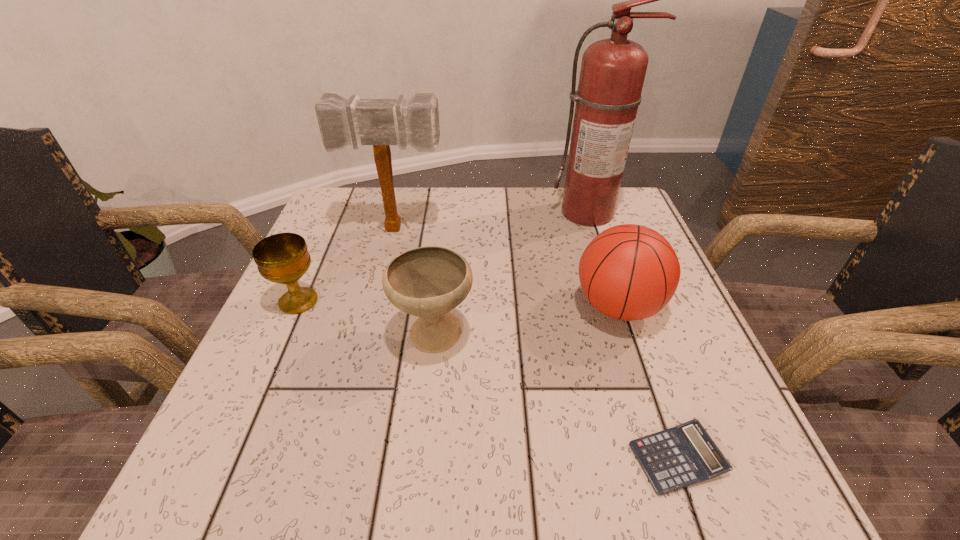
Find the location of a particular element. the closest object to the right chalice is located at coordinates (283, 258).

Locate an element on the screen. free space in the image that satisfies the following two spatial constraints: 1. on the front side of the shortest object; 2. on the right side of the right chalice is located at coordinates (420, 458).

Find the location of a particular element. This screenshot has width=960, height=540. free space that satisfies the following two spatial constraints: 1. on the front-facing side of the fire extinguisher; 2. on the left side of the calculator is located at coordinates (672, 458).

What are the coordinates of `free location that satisfies the following two spatial constraints: 1. on the front side of the right chalice; 2. on the right side of the nearest object` in the screenshot? It's located at (420, 458).

At what (x,y) coordinates should I click in order to perform the action: click on free spot that satisfies the following two spatial constraints: 1. on the front side of the basketball; 2. on the left side of the mallet. Please return your answer as a coordinate pair (x, y). The height and width of the screenshot is (540, 960). Looking at the image, I should click on (376, 307).